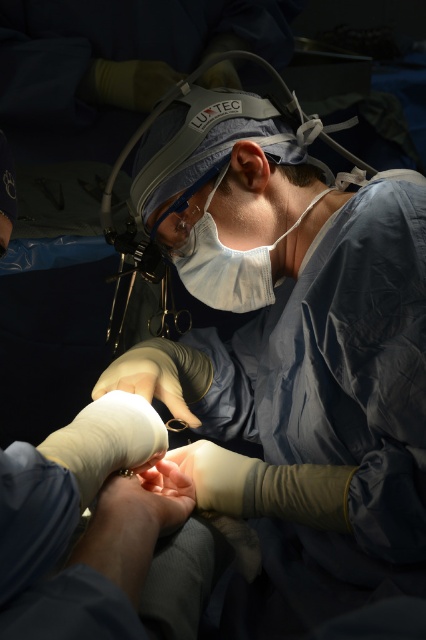
Is white fabric mask at center shorter than matte plastic surgical loupes at center?

Yes.

Image resolution: width=426 pixels, height=640 pixels. What do you see at coordinates (244, 232) in the screenshot?
I see `white fabric mask at center` at bounding box center [244, 232].

Does point (317, 192) lie behind point (169, 141)?

Yes, it is.

Locate an element on the screen. The height and width of the screenshot is (640, 426). white fabric mask at center is located at coordinates (244, 232).